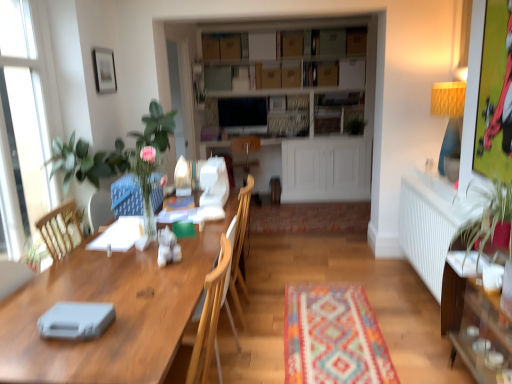
Question: Is the depth of wooden cabinet at right less than that of wooden chair at center?

Choices:
 (A) no
 (B) yes

Answer: (B)

Question: From a real-world perspective, is wooden cabinet at right beneath wooden chair at center?

Choices:
 (A) yes
 (B) no

Answer: (A)

Question: Is wooden cabinet at right completely or partially outside of wooden chair at center?

Choices:
 (A) no
 (B) yes

Answer: (B)

Question: From a real-world perspective, is wooden cabinet at right on wooden chair at center?

Choices:
 (A) no
 (B) yes

Answer: (A)

Question: Is wooden cabinet at right aimed at wooden chair at center?

Choices:
 (A) yes
 (B) no

Answer: (A)

Question: From the image's perspective, is wooden cabinet at right beneath wooden chair at center?

Choices:
 (A) no
 (B) yes

Answer: (B)

Question: Is blue fabric swivel chair at left taller than wooden cabinet at right?

Choices:
 (A) yes
 (B) no

Answer: (B)

Question: Does blue fabric swivel chair at left have a smaller size compared to wooden cabinet at right?

Choices:
 (A) yes
 (B) no

Answer: (A)

Question: Does blue fabric swivel chair at left have a lesser width compared to wooden cabinet at right?

Choices:
 (A) yes
 (B) no

Answer: (B)

Question: Does blue fabric swivel chair at left have a greater width compared to wooden cabinet at right?

Choices:
 (A) no
 (B) yes

Answer: (B)

Question: Is blue fabric swivel chair at left closer to camera compared to wooden cabinet at right?

Choices:
 (A) no
 (B) yes

Answer: (A)

Question: Is blue fabric swivel chair at left behind wooden cabinet at right?

Choices:
 (A) yes
 (B) no

Answer: (A)

Question: Is wooden armchair at center wider than white glass window at left?

Choices:
 (A) yes
 (B) no

Answer: (A)